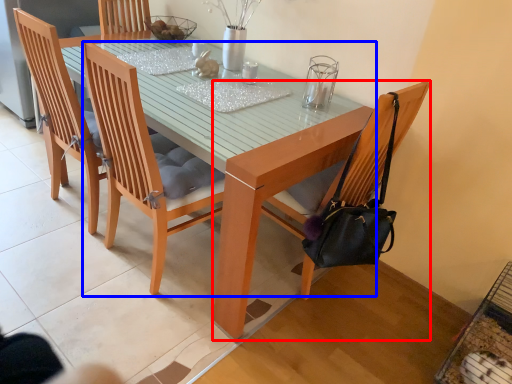
Question: Among these objects, which one is farthest to the camera, chair (highlighted by a red box) or chair (highlighted by a blue box)?

Choices:
 (A) chair
 (B) chair

Answer: (A)